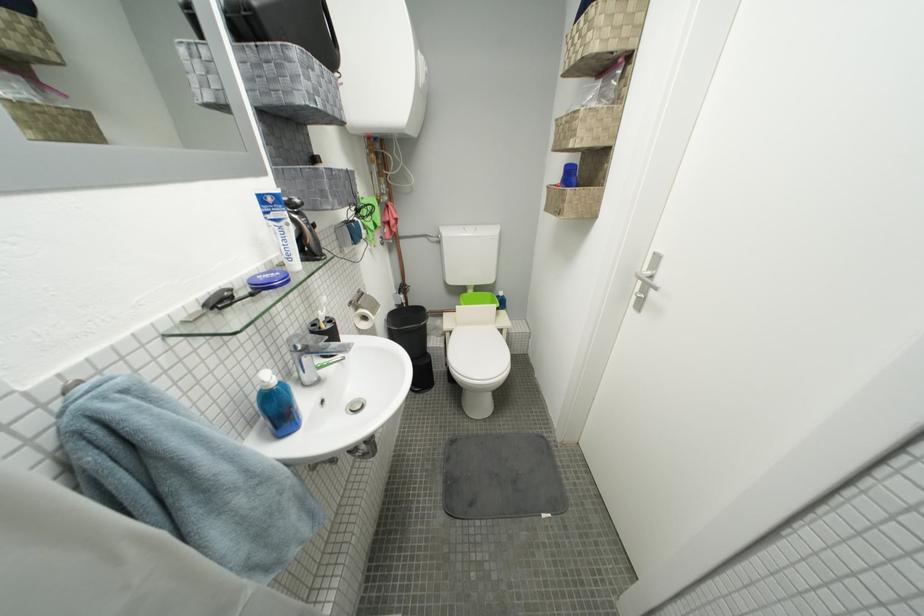
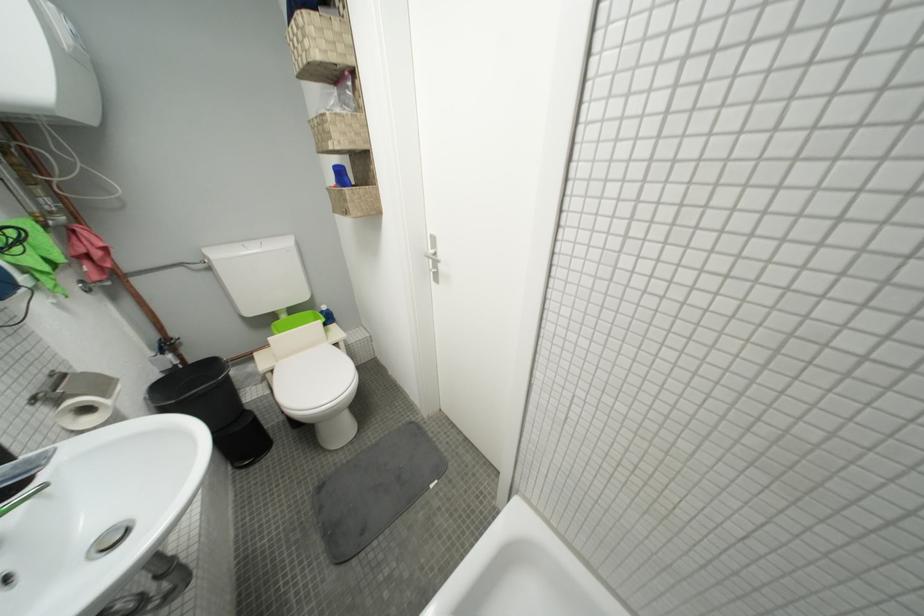
Find the pixel in the second image that matches [649,282] in the first image.

(438, 261)